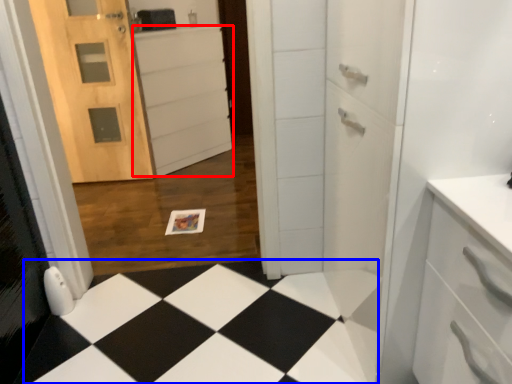
Question: Which of the following is the farthest to the observer, cabinetry (highlighted by a red box) or square (highlighted by a blue box)?

Choices:
 (A) cabinetry
 (B) square

Answer: (A)